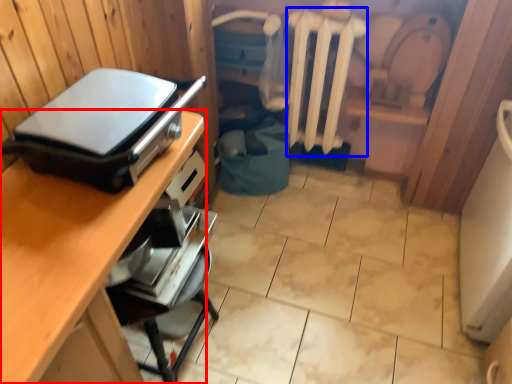
Question: Which point is closer to the camera, desk (highlighted by a red box) or radiator (highlighted by a blue box)?

Choices:
 (A) desk
 (B) radiator

Answer: (A)